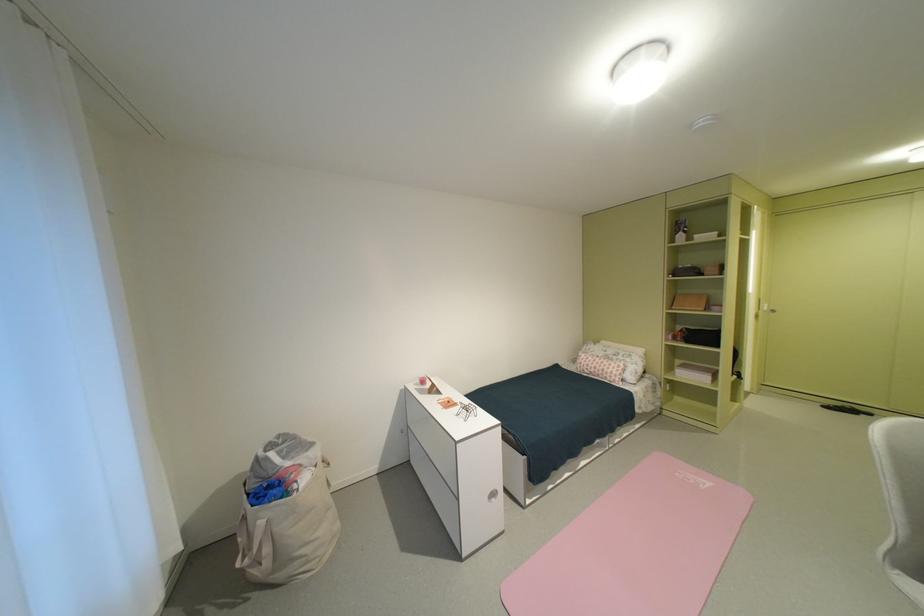
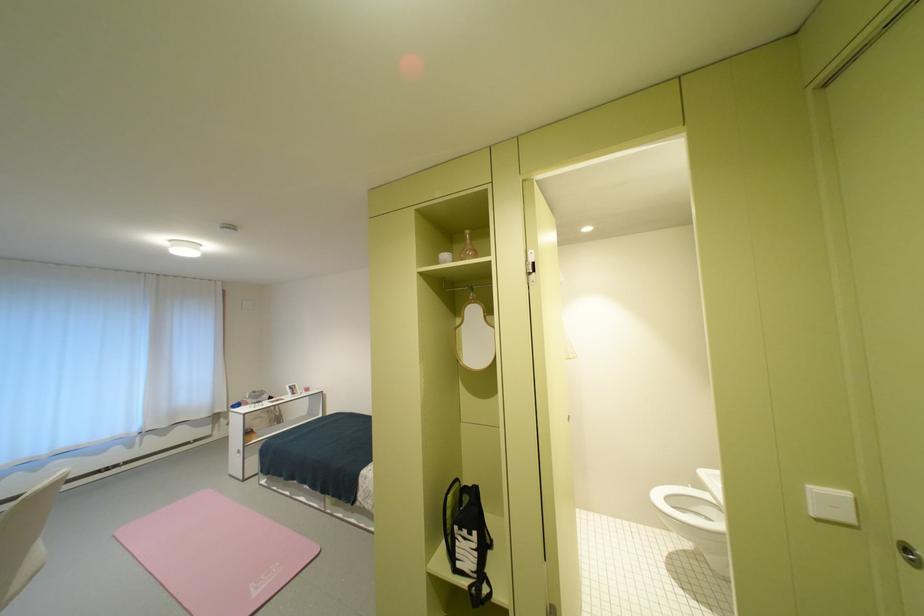
Where in the second image is the point corresponding to point 686,476 from the first image?

(286, 565)